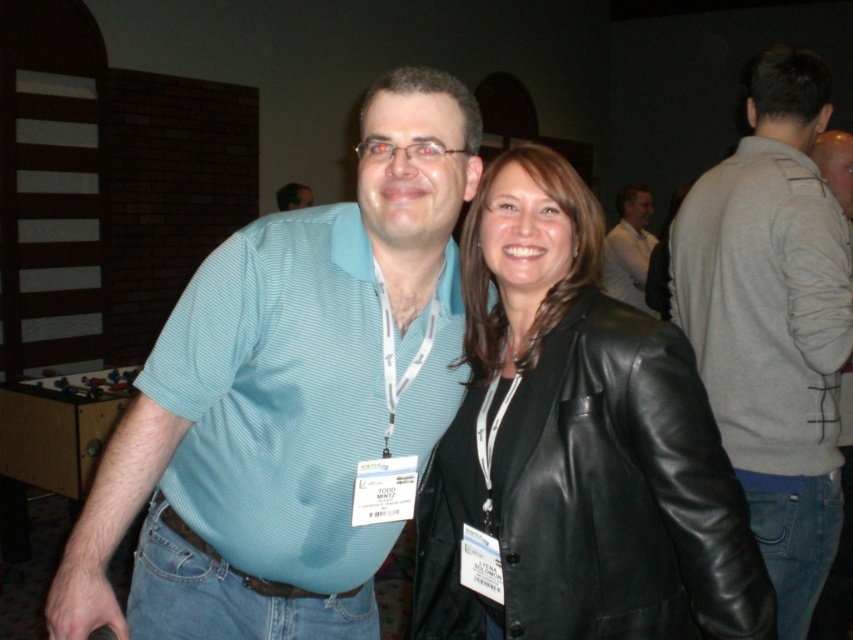
Question: Is teal striped shirt at center wider than gray sweater at right?

Choices:
 (A) no
 (B) yes

Answer: (B)

Question: Where is teal striped shirt at center located in relation to white matte shirt at upper center in the image?

Choices:
 (A) below
 (B) above

Answer: (A)

Question: Which point is closer to the camera?

Choices:
 (A) smooth skin at center
 (B) gray sweater at right

Answer: (B)

Question: Which object is closer to the camera taking this photo?

Choices:
 (A) gray sweater at center
 (B) black leather jacket at center
 (C) white matte shirt at upper center
 (D) smooth skin at center

Answer: (B)

Question: Which point is closer to the camera?

Choices:
 (A) gray sweater at center
 (B) black leather jacket at center
 (C) white matte shirt at upper center

Answer: (B)

Question: Can you confirm if teal striped shirt at center is smaller than white matte shirt at upper center?

Choices:
 (A) yes
 (B) no

Answer: (A)